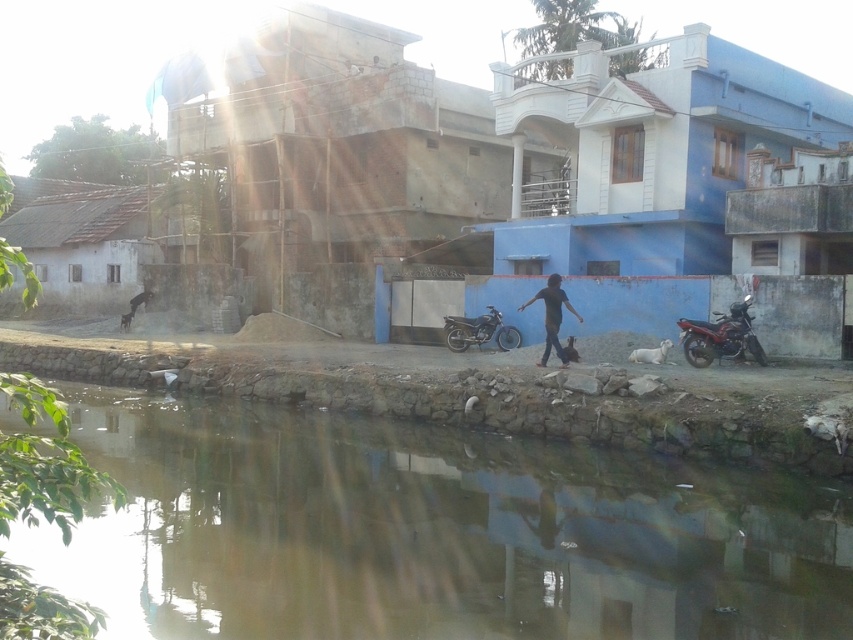
Question: Which point is closer to the camera?

Choices:
 (A) brown sedimentary river at lower center
 (B) dark gray shirt at center
 (C) shiny metallic motorcycle at center

Answer: (A)

Question: In this image, where is brown sedimentary river at lower center located relative to dark gray shirt at center?

Choices:
 (A) left
 (B) right

Answer: (A)

Question: Which point is closer to the camera taking this photo?

Choices:
 (A) (695, 328)
 (B) (334, 438)

Answer: (B)

Question: Is brown sedimentary river at lower center wider than shiny metallic motorcycle at right?

Choices:
 (A) yes
 (B) no

Answer: (A)

Question: Among these points, which one is farthest from the camera?

Choices:
 (A) (x=567, y=300)
 (B) (x=506, y=349)

Answer: (B)

Question: Can you confirm if shiny metallic motorcycle at center is bigger than dark gray shirt at center?

Choices:
 (A) yes
 (B) no

Answer: (A)